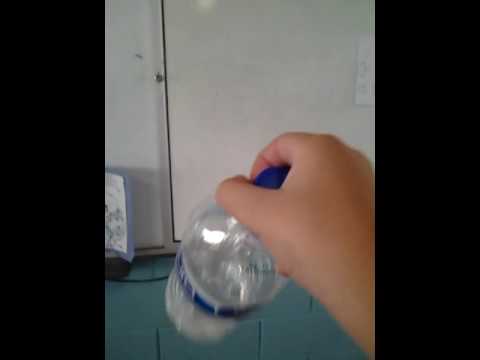
Image resolution: width=480 pixels, height=360 pixels. Identify the location of table. [115, 231].